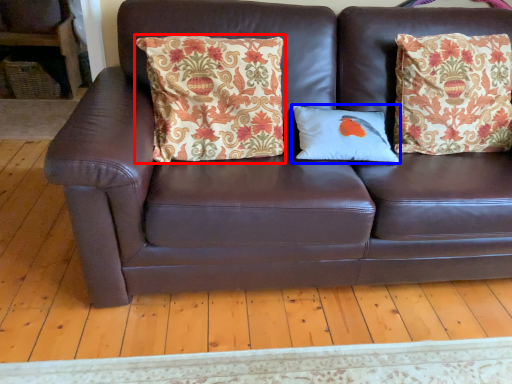
Question: Which point is further to the camera, pillow (highlighted by a red box) or pillow (highlighted by a blue box)?

Choices:
 (A) pillow
 (B) pillow

Answer: (B)